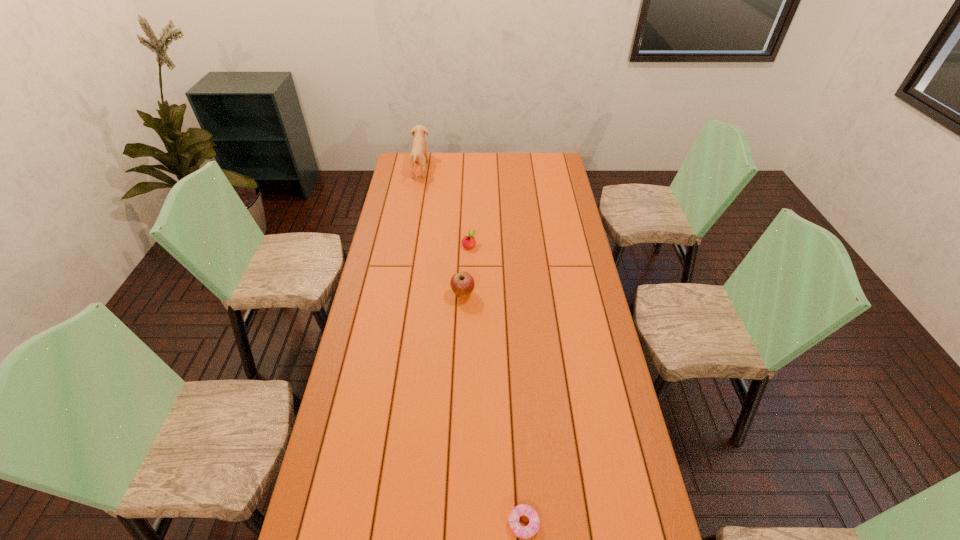
Find the location of a particular element. This screenshot has width=960, height=540. unoccupied area between the farther apple and the tallest object is located at coordinates (444, 207).

I want to click on object that stands as the second closest to the farther apple, so click(x=419, y=153).

Select which object appears as the second closest to the farthest object. Please provide its 2D coordinates. Your answer should be formatted as a tuple, i.e. [(x, y)], where the tuple contains the x and y coordinates of a point satisfying the conditions above.

[(462, 283)]

Where is `free space that satisfies the following two spatial constraints: 1. on the left side of the second shortest object; 2. on the right side of the tallest object`? This screenshot has width=960, height=540. free space that satisfies the following two spatial constraints: 1. on the left side of the second shortest object; 2. on the right side of the tallest object is located at coordinates (406, 245).

You are a GUI agent. You are given a task and a screenshot of the screen. Output one action in this format:
    pyautogui.click(x=<x>, y=<y>)
    Task: Click on the free spot that satisfies the following two spatial constraints: 1. on the back side of the third farthest object; 2. on the left side of the tallest object
    The image size is (960, 540).
    Given the screenshot: What is the action you would take?
    (468, 168)

I want to click on free space that satisfies the following two spatial constraints: 1. on the left side of the farthest object; 2. on the back side of the farther apple, so [x=406, y=245].

The image size is (960, 540). Identify the location of free space that satisfies the following two spatial constraints: 1. on the left side of the third shortest object; 2. on the left side of the leftmost object. (397, 294).